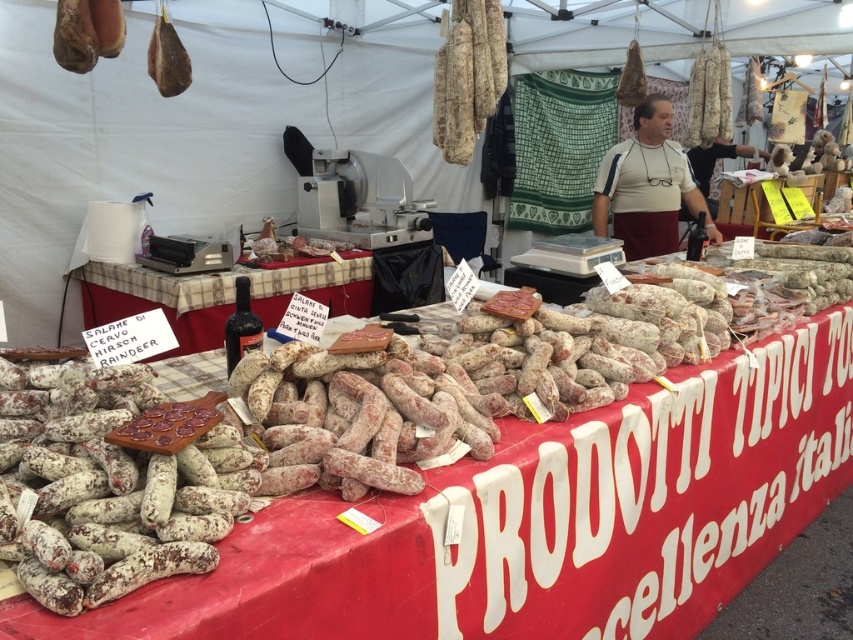
Question: Which point appears closest to the camera in this image?

Choices:
 (A) (215, 449)
 (B) (76, 280)
 (C) (166, 26)
 (D) (682, 202)

Answer: (A)

Question: Is plaid fabric table at center below matte brown cured meat at upper left?

Choices:
 (A) no
 (B) yes

Answer: (B)

Question: Considering the real-world distances, which object is farthest from the white fabric apron at center?

Choices:
 (A) speckled white sausage at center
 (B) plaid fabric table at center
 (C) matte brown cured meat at upper left

Answer: (A)

Question: Which object appears closest to the camera in this image?

Choices:
 (A) white fabric apron at center
 (B) matte brown cured meat at upper left
 (C) speckled white sausage at center

Answer: (C)

Question: Is speckled white sausage at center positioned in front of matte brown cured meat at upper left?

Choices:
 (A) yes
 (B) no

Answer: (A)

Question: Does speckled white sausage at center lie in front of white fabric apron at center?

Choices:
 (A) yes
 (B) no

Answer: (A)